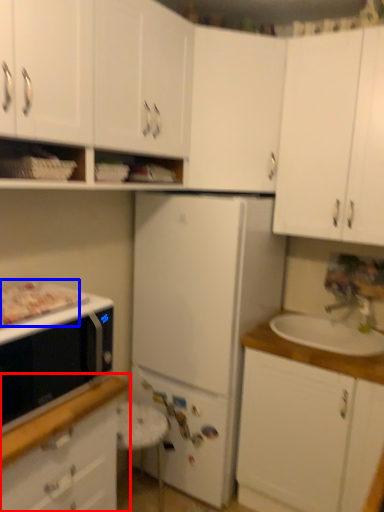
Question: Which object appears farthest to the camera in this image, cabinetry (highlighted by a red box) or food (highlighted by a blue box)?

Choices:
 (A) cabinetry
 (B) food

Answer: (B)